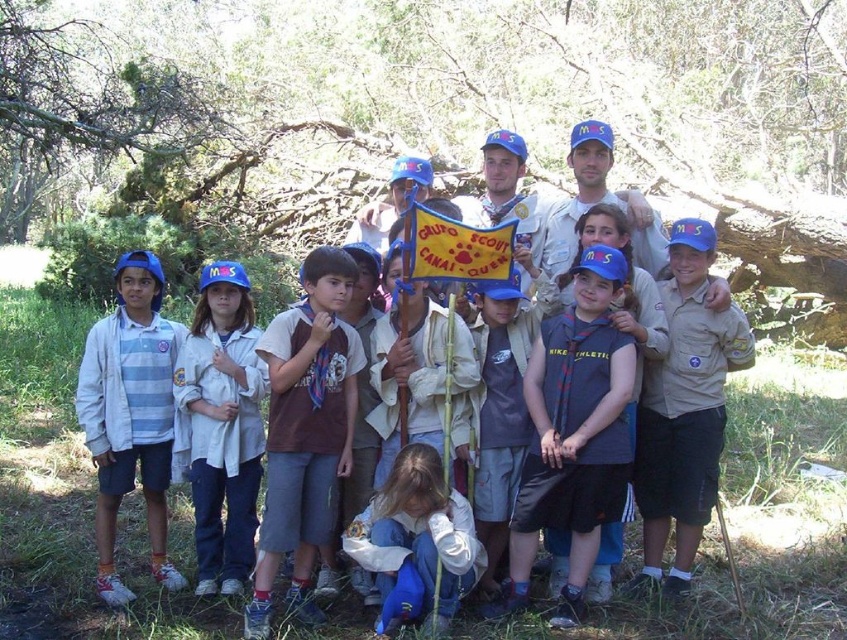
Is blue fabric pants at center shorter than yellow fabric flag at center?

Incorrect, blue fabric pants at center's height does not fall short of yellow fabric flag at center's.

Is point (469, 529) positioned in front of point (438, 269)?

Yes.

This screenshot has width=847, height=640. In order to click on blue fabric pants at center in this screenshot , I will do `click(416, 541)`.

Does white matte shirt at center appear under blue fabric pants at center?

No, white matte shirt at center is not below blue fabric pants at center.

How much distance is there between white matte shirt at center and blue fabric pants at center?

They are 4.49 feet apart.

From the picture: Who is more distant from viewer, (213, 280) or (438, 476)?

Point (213, 280)

Where is `white matte shirt at center`? The width and height of the screenshot is (847, 640). white matte shirt at center is located at coordinates (222, 426).

What do you see at coordinates (574, 433) in the screenshot? I see `dark blue jersey at center` at bounding box center [574, 433].

Who is higher up, dark blue jersey at center or blue fabric pants at center?

Positioned higher is dark blue jersey at center.

Describe the element at coordinates (574, 433) in the screenshot. I see `dark blue jersey at center` at that location.

The image size is (847, 640). I want to click on dark blue jersey at center, so click(x=574, y=433).